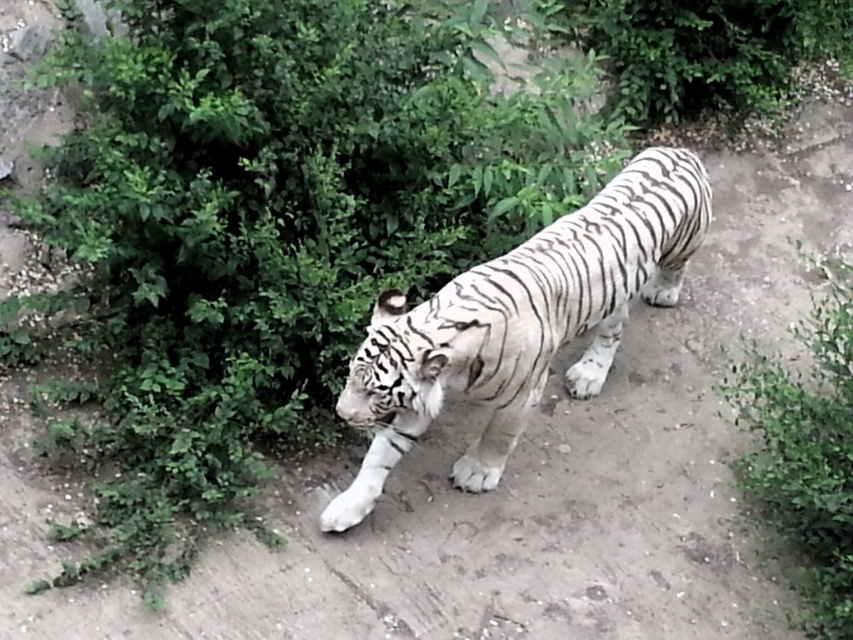
Question: Among these points, which one is farthest from the camera?

Choices:
 (A) (809, 326)
 (B) (567, 268)

Answer: (A)

Question: Can you confirm if white striped tiger at center is wider than green leafy bush at lower right?

Choices:
 (A) yes
 (B) no

Answer: (A)

Question: Can you confirm if white striped tiger at center is wider than green leafy bush at lower right?

Choices:
 (A) no
 (B) yes

Answer: (B)

Question: Is white striped tiger at center to the right of green leafy bush at lower right from the viewer's perspective?

Choices:
 (A) yes
 (B) no

Answer: (B)

Question: Among these points, which one is farthest from the camera?

Choices:
 (A) (840, 380)
 (B) (595, 234)

Answer: (B)